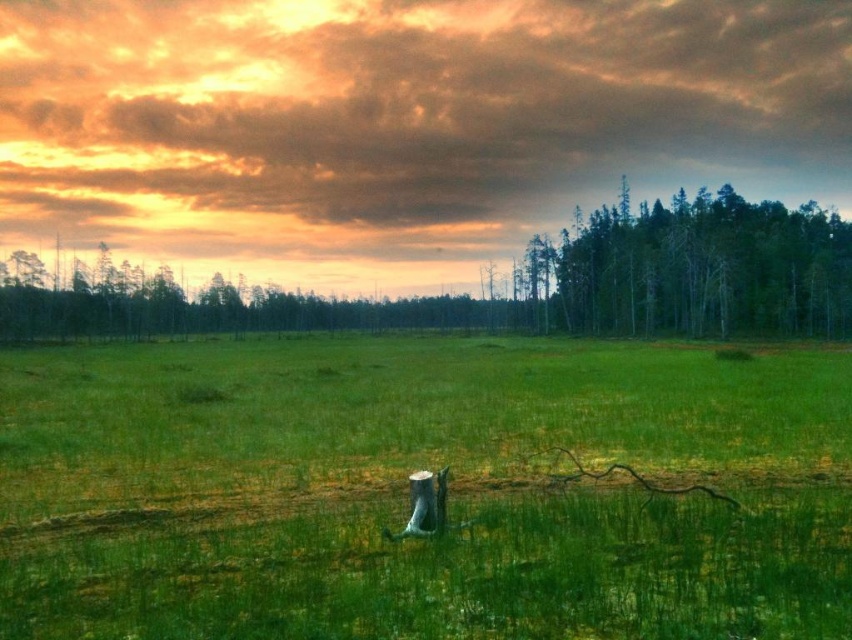
Question: Does green grassy pasture at center appear over green matte trees at right?

Choices:
 (A) no
 (B) yes

Answer: (A)

Question: Which point appears farthest from the camera in this image?

Choices:
 (A) [723, 236]
 (B) [185, 529]

Answer: (A)

Question: Is green grassy pasture at center to the left of green matte trees at right from the viewer's perspective?

Choices:
 (A) yes
 (B) no

Answer: (A)

Question: Can you confirm if green grassy pasture at center is wider than green matte trees at right?

Choices:
 (A) no
 (B) yes

Answer: (B)

Question: Among these points, which one is farthest from the camera?

Choices:
 (A) (815, 225)
 (B) (695, 422)

Answer: (A)